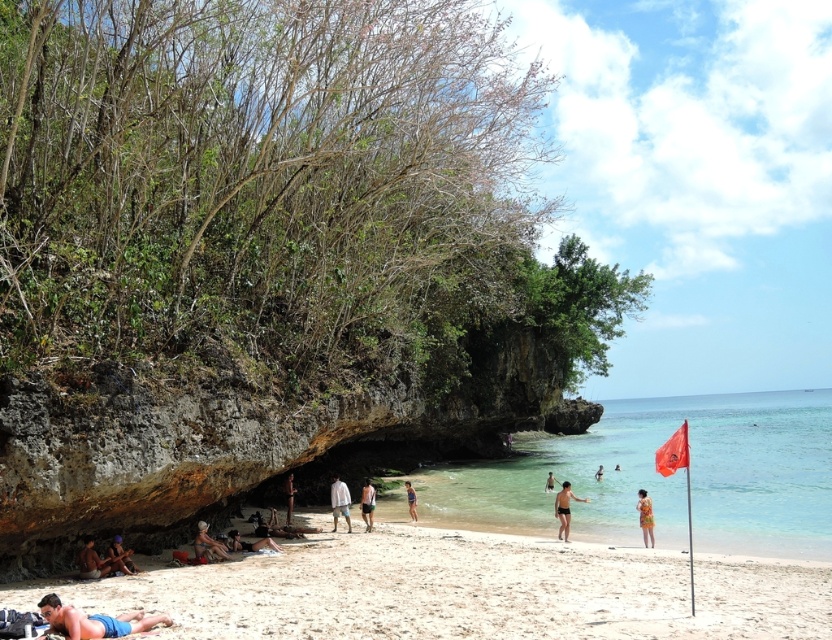
Which of these two, smooth tan skin at lower left or black swimsuit at center, stands shorter?

With less height is smooth tan skin at lower left.

Does smooth tan skin at lower left appear over black swimsuit at center?

Yes.

Does point (202, 532) come behind point (597, 476)?

No, (202, 532) is in front of (597, 476).

Locate an element on the screen. Image resolution: width=832 pixels, height=640 pixels. smooth tan skin at lower left is located at coordinates (208, 545).

From the picture: Does printed fabric swimsuit at lower right have a lesser height compared to nude human at center?

In fact, printed fabric swimsuit at lower right may be taller than nude human at center.

Does printed fabric swimsuit at lower right appear over nude human at center?

Incorrect, printed fabric swimsuit at lower right is not positioned above nude human at center.

Is point (640, 508) positioned in front of point (290, 516)?

Yes, it is.

Identify the location of printed fabric swimsuit at lower right. This screenshot has width=832, height=640. (645, 516).

Looking at this image, who is positioned more to the right, clear blue water at beach right or smooth skin person at center?

clear blue water at beach right is more to the right.

Looking at this image, who is more forward, (580, 452) or (548, 472)?

Point (548, 472)

The image size is (832, 640). I want to click on clear blue water at beach right, so (x=664, y=477).